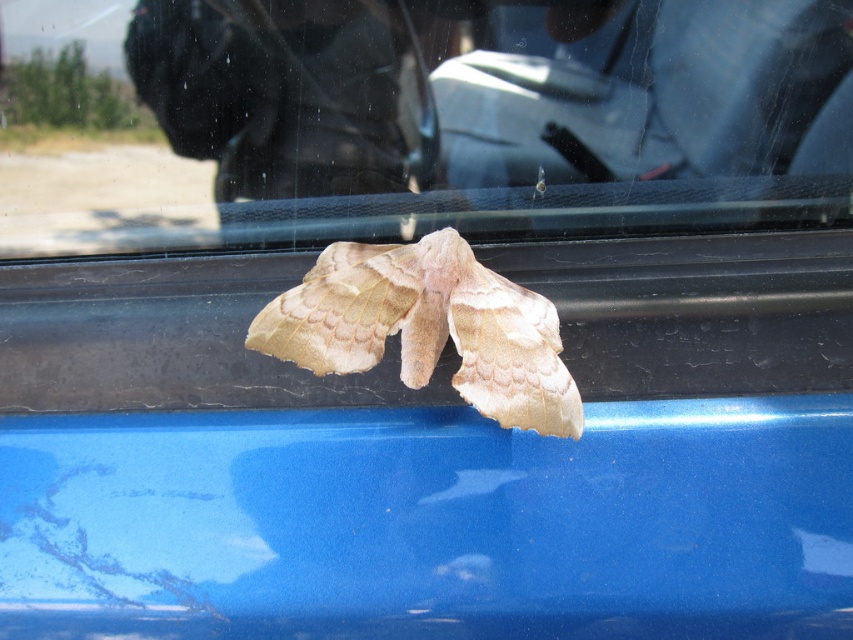
Question: Does transparent glass moth at center appear under fuzzy beige moth at center?

Choices:
 (A) yes
 (B) no

Answer: (B)

Question: Which object is closer to the camera taking this photo?

Choices:
 (A) fuzzy beige moth at center
 (B) transparent glass moth at center

Answer: (B)

Question: From the image, what is the correct spatial relationship of transparent glass moth at center in relation to fuzzy beige moth at center?

Choices:
 (A) left
 (B) right

Answer: (A)

Question: Can you confirm if transparent glass moth at center is smaller than fuzzy beige moth at center?

Choices:
 (A) yes
 (B) no

Answer: (B)

Question: Which of the following is the closest to the observer?

Choices:
 (A) fuzzy beige moth at center
 (B) transparent glass moth at center

Answer: (B)